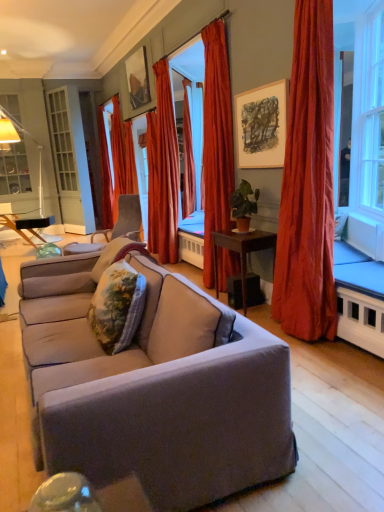
Question: In terms of size, does matte wooden picture frame at upper center, marked as the first picture frame in a right-to-left arrangement, appear bigger or smaller than silky orange curtain at center, arranged as the third curtain when viewed from the right?

Choices:
 (A) small
 (B) big

Answer: (A)

Question: Do you think matte wooden picture frame at upper center, placed as the second picture frame when sorted from left to right, is within silky orange curtain at center, arranged as the third curtain when viewed from the right, or outside of it?

Choices:
 (A) outside
 (B) inside

Answer: (A)

Question: Which object is the closest to the wooden table at left, marked as the first table in a left-to-right arrangement?

Choices:
 (A) matte wooden picture frame at upper center, which is counted as the 2th picture frame, starting from the back
 (B) velvet red curtain at left, which appears as the first curtain when viewed from the left
 (C) satin red curtain at right, which ranks as the fifth curtain in back-to-front order
 (D) floral fabric pillow at center, which is counted as the second pillow, starting from the back
 (E) metallic reflective frame at upper center, arranged as the second picture frame when ordered from the bottom

Answer: (B)

Question: Estimate the real-world distances between objects in this image. Which object is closer to the velvet gray chair at center?

Choices:
 (A) floral fabric pillow at center, which is counted as the second pillow, starting from the back
 (B) metallic reflective frame at upper center, the second picture frame from the right
 (C) matte gray couch at center
 (D) matte wooden picture frame at upper center, arranged as the 1th picture frame when ordered from the bottom
 (E) matte black floor lamp at left

Answer: (B)